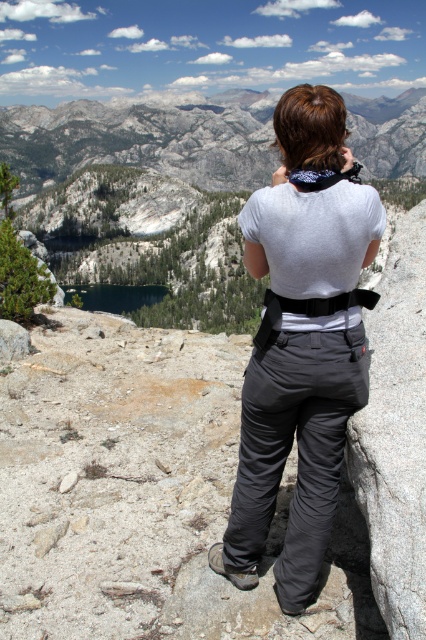
Question: Which point is farther to the camera?

Choices:
 (A) pyautogui.click(x=221, y=560)
 (B) pyautogui.click(x=146, y=284)

Answer: (B)

Question: Is the position of gray rock formation at upper center less distant than that of deep blue water at center?

Choices:
 (A) no
 (B) yes

Answer: (A)

Question: Does gray fabric pants at center have a lesser width compared to gray rock formation at upper center?

Choices:
 (A) no
 (B) yes

Answer: (B)

Question: Which of the following is the closest to the observer?

Choices:
 (A) gray rock formation at upper center
 (B) deep blue water at center
 (C) gray fabric pants at center

Answer: (C)

Question: Considering the real-world distances, which object is farthest from the deep blue water at center?

Choices:
 (A) gray fabric pants at center
 (B) gray rock formation at upper center

Answer: (B)

Question: Can you confirm if gray fabric pants at center is positioned above deep blue water at center?

Choices:
 (A) no
 (B) yes

Answer: (A)